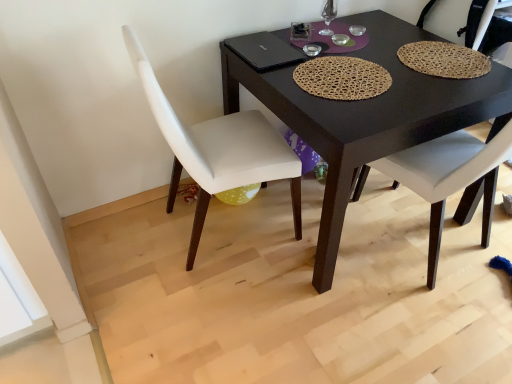
Find the location of a particular element. The height and width of the screenshot is (384, 512). vacant area that lies in front of black matte table at center is located at coordinates (340, 321).